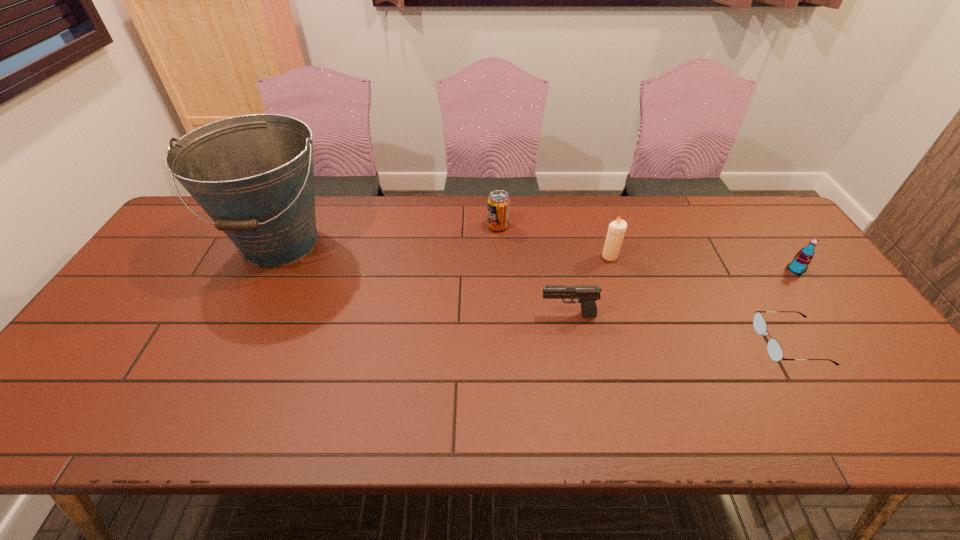
Where is `object that is the fifth closest to the nearer soda`? This screenshot has height=540, width=960. object that is the fifth closest to the nearer soda is located at coordinates (253, 175).

This screenshot has height=540, width=960. What are the coordinates of `the fifth closest object relative to the rightmost object` in the screenshot? It's located at (253, 175).

The image size is (960, 540). In order to click on vacant space that satisfies the following two spatial constraints: 1. with the handle on opposite sides of the leftmost object; 2. on the left side of the second tallest object in this screenshot , I will do `click(275, 256)`.

Image resolution: width=960 pixels, height=540 pixels. Identify the location of free space that satisfies the following two spatial constraints: 1. with the handle on opposite sides of the leftmost object; 2. on the right side of the fifth shortest object. (275, 256).

Image resolution: width=960 pixels, height=540 pixels. In order to click on free region that satisfies the following two spatial constraints: 1. with the handle on opposite sides of the candle; 2. on the left side of the leftmost object in this screenshot , I will do `click(275, 256)`.

Where is `free space that satisfies the following two spatial constraints: 1. with the handle on opposite sides of the bucket; 2. on the left side of the right soda`? free space that satisfies the following two spatial constraints: 1. with the handle on opposite sides of the bucket; 2. on the left side of the right soda is located at coordinates (268, 269).

Locate an element on the screen. This screenshot has height=540, width=960. free spot that satisfies the following two spatial constraints: 1. with the handle on opposite sides of the tallest object; 2. on the right side of the second tallest object is located at coordinates (275, 256).

You are a GUI agent. You are given a task and a screenshot of the screen. Output one action in this format:
    pyautogui.click(x=<x>, y=<y>)
    Task: Click on the free spot that satisfies the following two spatial constraints: 1. on the front side of the rightmost object; 2. on the lenses of the shortest object
    
    Given the screenshot: What is the action you would take?
    pyautogui.click(x=849, y=343)